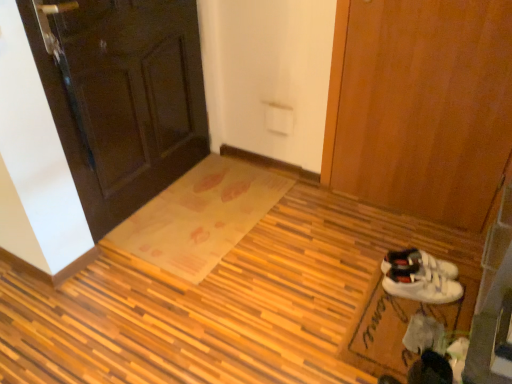
You are a GUI agent. You are given a task and a screenshot of the screen. Output one action in this format:
    pyautogui.click(x=<x>, y=<y>)
    Task: Click on the vacant area in front of translucent plastic doormat at center, the 1th doormat when ordered from left to right
    
    Given the screenshot: What is the action you would take?
    pos(199,316)